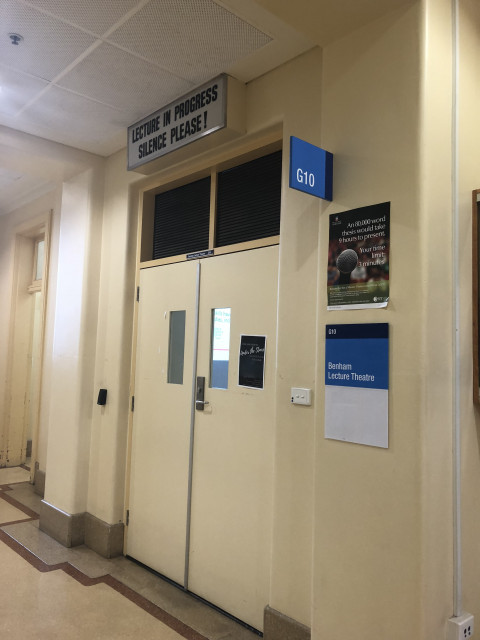
Identify the location of doors. (214, 454), (157, 435).